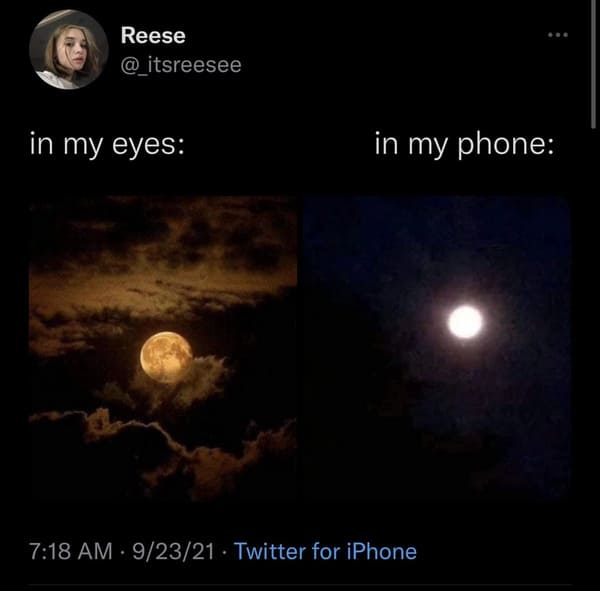
Find the location of a particular element. handle is located at coordinates (183, 71), (209, 71).